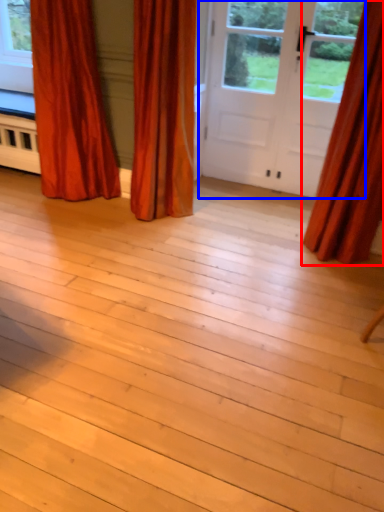
Question: Among these objects, which one is farthest to the camera, curtain (highlighted by a red box) or door (highlighted by a blue box)?

Choices:
 (A) curtain
 (B) door

Answer: (B)